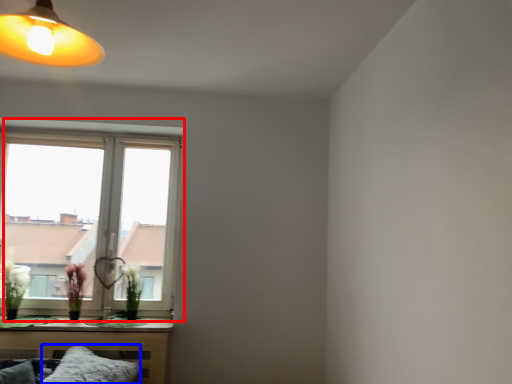
Question: Which point is further to the camera, window (highlighted by a red box) or pillow (highlighted by a blue box)?

Choices:
 (A) window
 (B) pillow

Answer: (A)